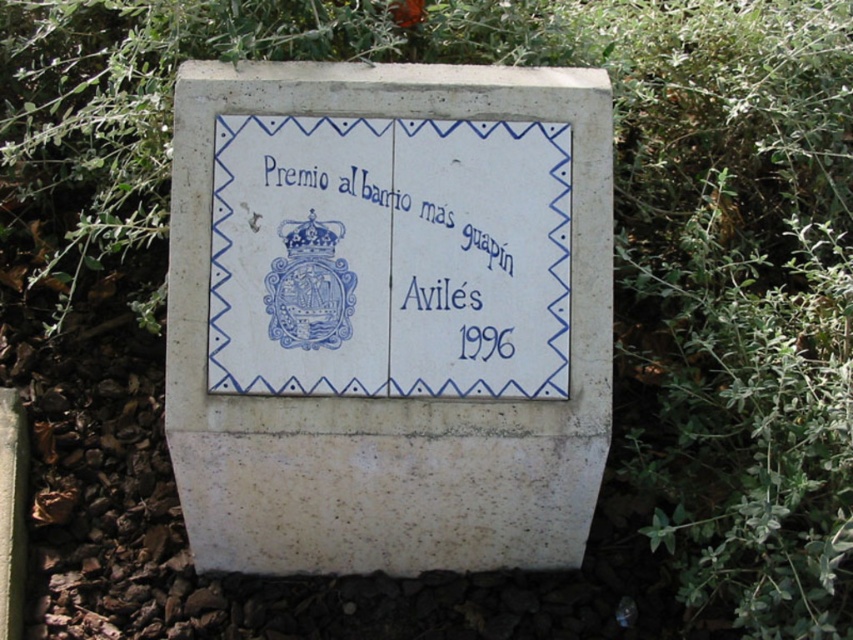
Question: Which point is farther to the camera?

Choices:
 (A) (312, 204)
 (B) (347, 285)

Answer: (A)

Question: Does white stone plaque at center appear on the left side of blue ceramic tile at center?

Choices:
 (A) no
 (B) yes

Answer: (A)

Question: Can you confirm if white stone plaque at center is positioned above blue ceramic tile at center?

Choices:
 (A) no
 (B) yes

Answer: (A)

Question: From the image, what is the correct spatial relationship of white stone plaque at center in relation to blue ceramic tile at center?

Choices:
 (A) below
 (B) above

Answer: (A)